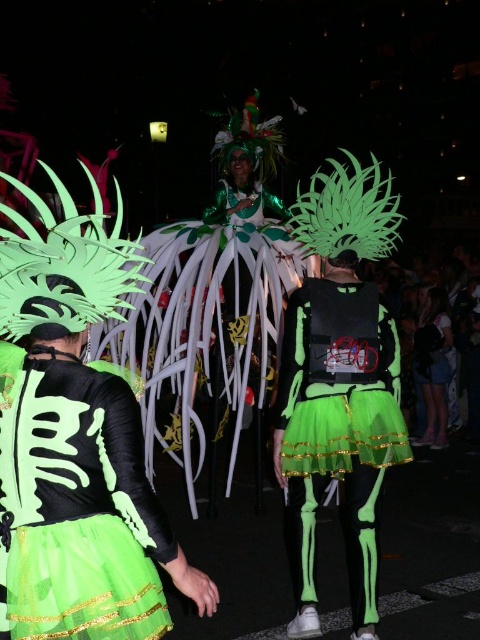
Between point (148, 602) and point (424, 384), which one is positioned in front?

Point (148, 602)

From the picture: Is neon green mesh dress at center wider than green fabric costume at center?

Correct, the width of neon green mesh dress at center exceeds that of green fabric costume at center.

What are the coordinates of `neon green mesh dress at center` in the screenshot? It's located at (75, 509).

Locate an element on the screen. neon green mesh dress at center is located at coordinates (75, 509).

Can you confirm if neon green mesh dress at center is thinner than neon green fabric skeleton at center?

Correct, neon green mesh dress at center's width is less than neon green fabric skeleton at center's.

Does neon green mesh dress at center come behind neon green fabric skeleton at center?

No, it is not.

Between point (84, 438) and point (354, 564), which one is positioned behind?

The point (354, 564) is more distant.

The height and width of the screenshot is (640, 480). I want to click on neon green mesh dress at center, so tap(75, 509).

Who is taller, neon green fabric skeleton at center or green fabric costume at center?

neon green fabric skeleton at center is taller.

Locate an element on the screen. The image size is (480, 640). neon green fabric skeleton at center is located at coordinates (336, 429).